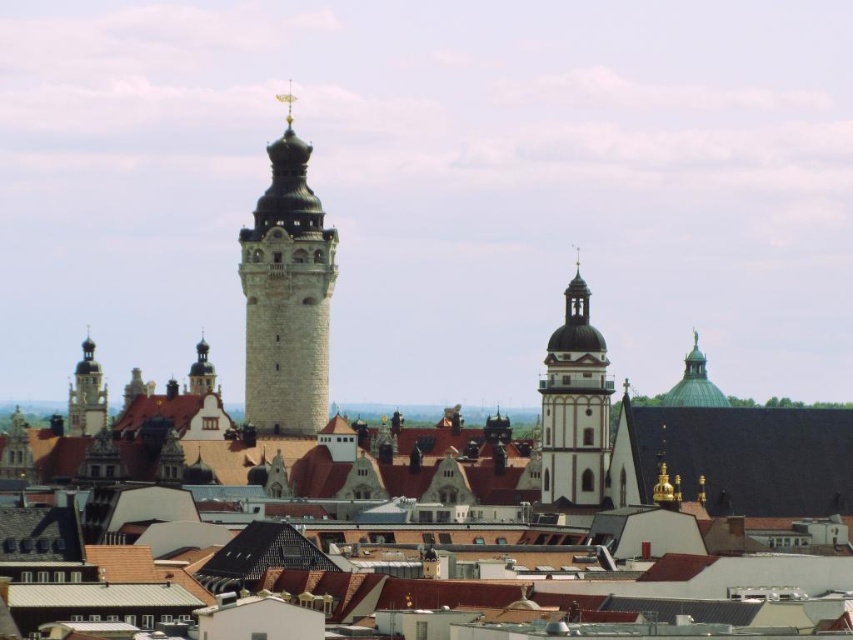
Question: Which point is closer to the camera?

Choices:
 (A) (850, 497)
 (B) (550, 397)
 (C) (280, 227)
 (D) (90, 346)

Answer: (A)

Question: Which object is farther from the camera taking this photo?

Choices:
 (A) matte brown tower at center-left
 (B) green tile roof at center
 (C) white stone tower at center

Answer: (A)

Question: Which point is farther from the camera taking this photo?

Choices:
 (A) (247, 328)
 (B) (706, 500)
 (C) (86, 412)

Answer: (C)

Question: From the image, what is the correct spatial relationship of smooth white tower at center in relation to matte brown tower at center-left?

Choices:
 (A) below
 (B) above

Answer: (B)

Question: Observing the image, what is the correct spatial positioning of green tile roof at center in reference to smooth white tower at center?

Choices:
 (A) above
 (B) below

Answer: (B)

Question: Can you confirm if green tile roof at center is positioned to the left of matte brown tower at center-left?

Choices:
 (A) no
 (B) yes

Answer: (A)